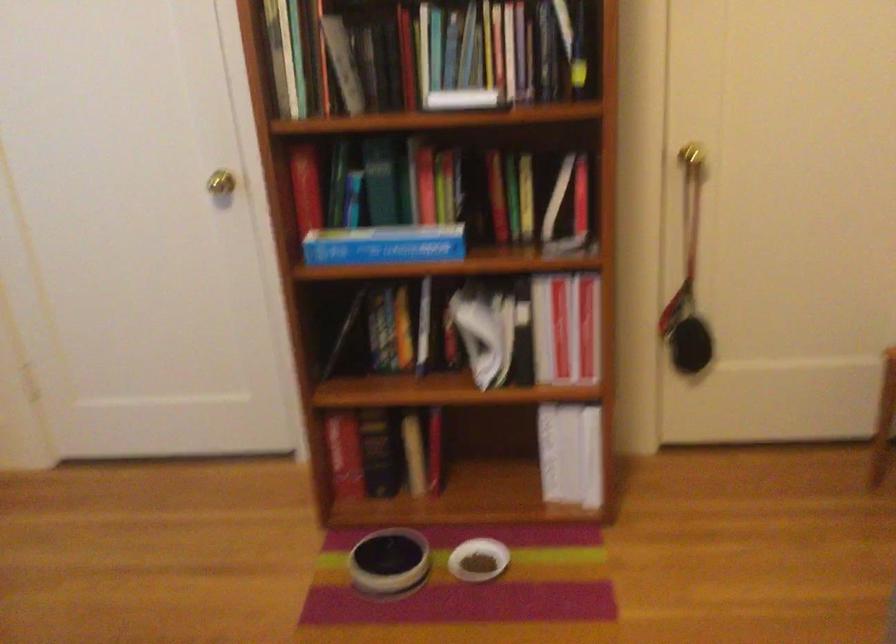
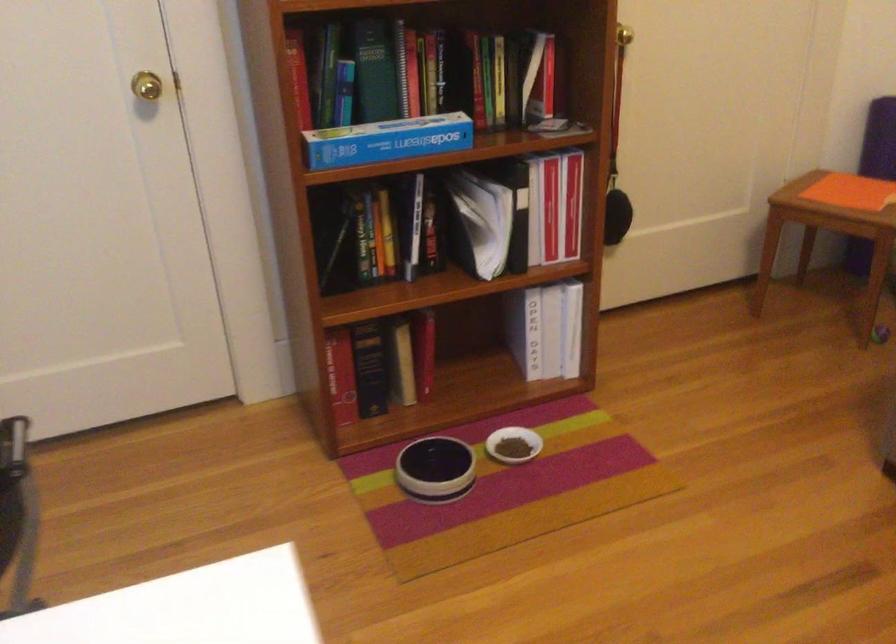
In the second image, find the point that corresponds to point (208, 182) in the first image.

(147, 86)